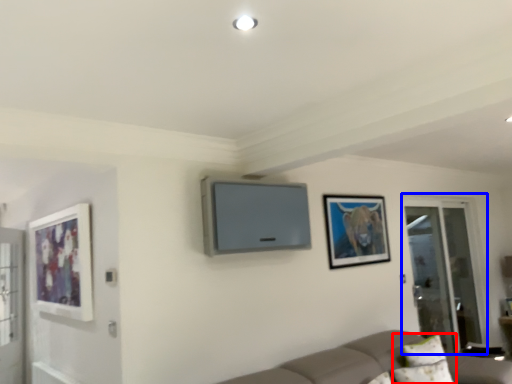
Question: Which object is closer to the camera taking this photo, pillow (highlighted by a red box) or screen door (highlighted by a blue box)?

Choices:
 (A) pillow
 (B) screen door

Answer: (A)